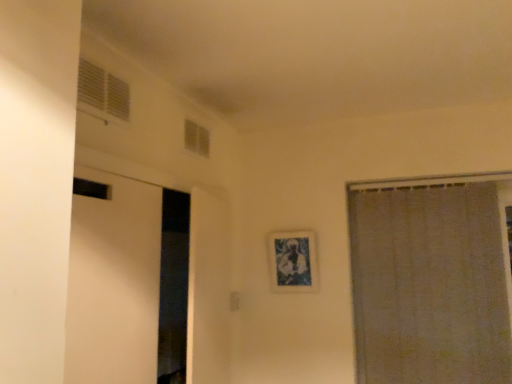
Question: Is white sheer curtain at right located within white plastic vent at upper left, which appears as the first window when viewed from the front?

Choices:
 (A) yes
 (B) no

Answer: (B)

Question: Considering the relative positions of white plastic vent at upper left, which ranks as the first window in left-to-right order, and white sheer curtain at right in the image provided, is white plastic vent at upper left, which ranks as the first window in left-to-right order, to the left of white sheer curtain at right from the viewer's perspective?

Choices:
 (A) no
 (B) yes

Answer: (B)

Question: Does white plastic vent at upper left, which appears as the first window when viewed from the front, have a greater width compared to white sheer curtain at right?

Choices:
 (A) yes
 (B) no

Answer: (B)

Question: Can you confirm if white plastic vent at upper left, which appears as the first window when viewed from the front, is thinner than white sheer curtain at right?

Choices:
 (A) yes
 (B) no

Answer: (A)

Question: Does white plastic vent at upper left, which appears as the first window when viewed from the front, have a larger size compared to white sheer curtain at right?

Choices:
 (A) no
 (B) yes

Answer: (A)

Question: From the image's perspective, is white plastic vent at upper left, which appears as the first window when viewed from the front, on white sheer curtain at right?

Choices:
 (A) no
 (B) yes

Answer: (B)

Question: Are white plastic vent at upper left, which ranks as the second window in right-to-left order, and transparent glass window at upper center, positioned as the first window in back-to-front order, making contact?

Choices:
 (A) no
 (B) yes

Answer: (A)

Question: Is white plastic vent at upper left, which appears as the first window when viewed from the front, to the left of transparent glass window at upper center, positioned as the first window in back-to-front order, from the viewer's perspective?

Choices:
 (A) yes
 (B) no

Answer: (A)

Question: Does white plastic vent at upper left, which appears as the first window when viewed from the front, have a smaller size compared to transparent glass window at upper center, which appears as the first window when viewed from the right?

Choices:
 (A) yes
 (B) no

Answer: (A)

Question: From the image's perspective, is white plastic vent at upper left, which ranks as the second window in right-to-left order, over transparent glass window at upper center, acting as the 2th window starting from the front?

Choices:
 (A) yes
 (B) no

Answer: (A)

Question: Does white plastic vent at upper left, which ranks as the first window in left-to-right order, have a greater width compared to transparent glass window at upper center, which appears as the first window when viewed from the right?

Choices:
 (A) no
 (B) yes

Answer: (A)

Question: From a real-world perspective, is white plastic vent at upper left, which appears as the first window when viewed from the front, under transparent glass window at upper center, which appears as the first window when viewed from the right?

Choices:
 (A) yes
 (B) no

Answer: (A)

Question: Is transparent glass window at upper center, which appears as the 2th window when viewed from the left, facing towards white sheer curtain at right?

Choices:
 (A) no
 (B) yes

Answer: (A)